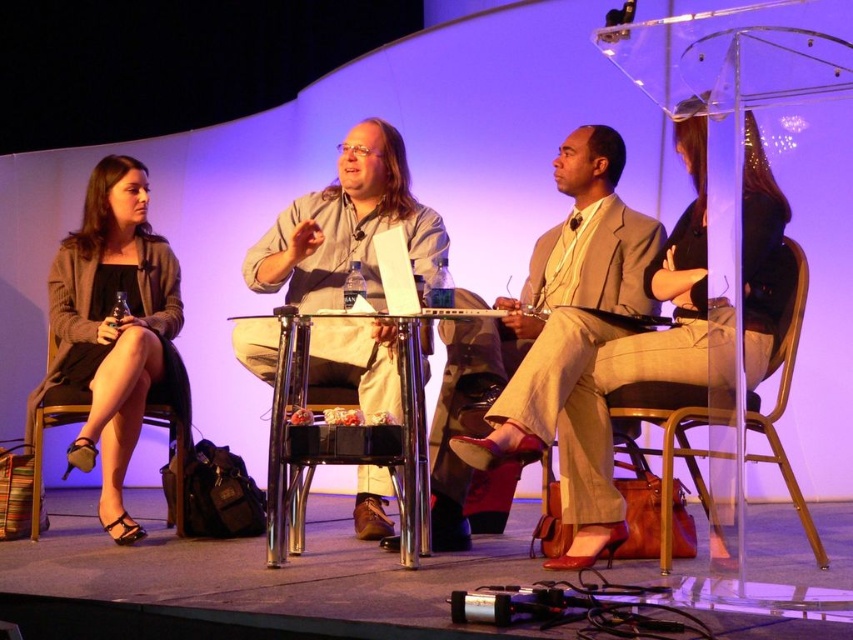
Between light beige cotton shirt at center and metallic gold chair at right, which one appears on the right side from the viewer's perspective?

Positioned to the right is metallic gold chair at right.

Who is positioned more to the left, light beige cotton shirt at center or metallic gold chair at right?

Positioned to the left is light beige cotton shirt at center.

Does point (367, 132) come behind point (665, 524)?

Yes, point (367, 132) is farther from viewer.

Where is `light beige cotton shirt at center`? light beige cotton shirt at center is located at coordinates (347, 227).

Is metallic gold chair at right to the right of black leather chair at lower left from the viewer's perspective?

Correct, you'll find metallic gold chair at right to the right of black leather chair at lower left.

Is metallic gold chair at right below black leather chair at lower left?

Actually, metallic gold chair at right is above black leather chair at lower left.

Is point (662, 516) in front of point (79, 394)?

Yes.

Locate an element on the screen. The height and width of the screenshot is (640, 853). metallic gold chair at right is located at coordinates (666, 442).

Can you confirm if metallic silver chair at center is positioned above metallic gold chair at right?

Yes, metallic silver chair at center is above metallic gold chair at right.

In the scene shown: Can you confirm if metallic silver chair at center is taller than metallic gold chair at right?

In fact, metallic silver chair at center may be shorter than metallic gold chair at right.

This screenshot has height=640, width=853. What do you see at coordinates (345, 440) in the screenshot? I see `metallic silver chair at center` at bounding box center [345, 440].

You are a GUI agent. You are given a task and a screenshot of the screen. Output one action in this format:
    pyautogui.click(x=<x>, y=<y>)
    Task: Click on the metallic silver chair at center
    
    Given the screenshot: What is the action you would take?
    pyautogui.click(x=345, y=440)